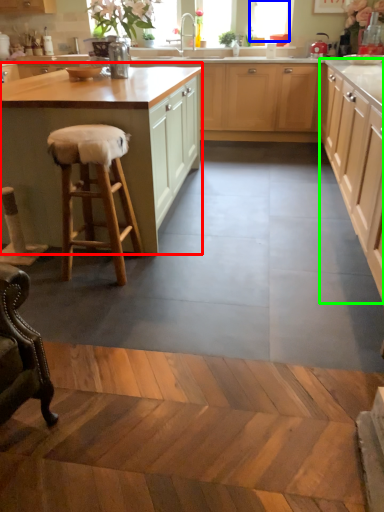
Question: Based on their relative distances, which object is farther from cabinetry (highlighted by a red box)? Choose from window (highlighted by a blue box) and cabinetry (highlighted by a green box).

Choices:
 (A) window
 (B) cabinetry

Answer: (A)